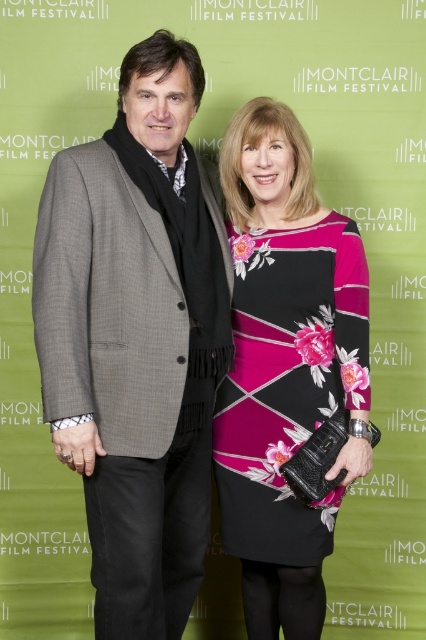
Question: Is gray wool blazer at center smaller than floral-patterned dress at center?

Choices:
 (A) yes
 (B) no

Answer: (B)

Question: Does gray wool blazer at center have a larger size compared to floral-patterned dress at center?

Choices:
 (A) yes
 (B) no

Answer: (A)

Question: Can you confirm if gray wool blazer at center is bigger than floral-patterned dress at center?

Choices:
 (A) no
 (B) yes

Answer: (B)

Question: Among these points, which one is nearest to the camera?

Choices:
 (A) (313, 179)
 (B) (173, 214)

Answer: (B)